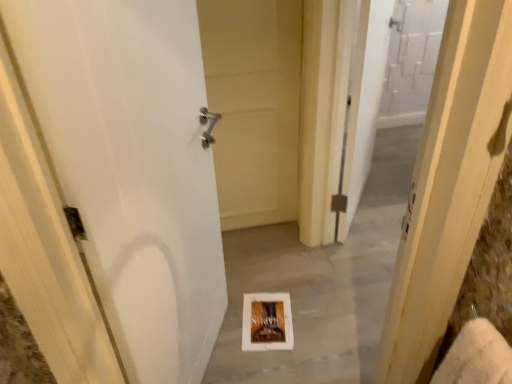
Identify the location of vacant space behind white cardboard book at center. The height and width of the screenshot is (384, 512). (264, 273).